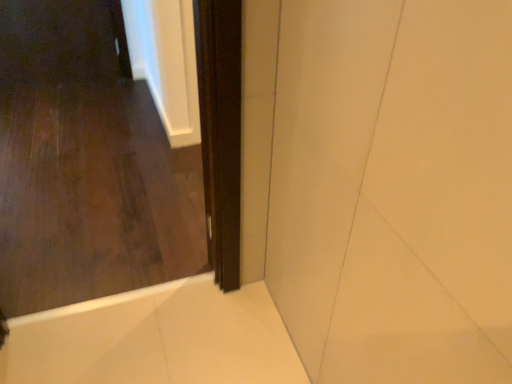
Question: Is dark wood door at center located outside dark wood screen door at center?

Choices:
 (A) no
 (B) yes

Answer: (B)

Question: Is dark wood door at center oriented away from dark wood screen door at center?

Choices:
 (A) no
 (B) yes

Answer: (A)

Question: Does dark wood door at center have a greater width compared to dark wood screen door at center?

Choices:
 (A) yes
 (B) no

Answer: (A)

Question: Does dark wood door at center come in front of dark wood screen door at center?

Choices:
 (A) no
 (B) yes

Answer: (B)

Question: Does dark wood door at center have a smaller size compared to dark wood screen door at center?

Choices:
 (A) yes
 (B) no

Answer: (B)

Question: Are dark wood door at center and dark wood screen door at center located far from each other?

Choices:
 (A) no
 (B) yes

Answer: (A)

Question: Can you confirm if white glossy bath at lower right is bigger than dark wood door at center?

Choices:
 (A) yes
 (B) no

Answer: (B)

Question: Is white glossy bath at lower right to the left of dark wood door at center from the viewer's perspective?

Choices:
 (A) no
 (B) yes

Answer: (A)

Question: Does white glossy bath at lower right have a lesser width compared to dark wood door at center?

Choices:
 (A) yes
 (B) no

Answer: (B)

Question: From the image's perspective, is white glossy bath at lower right located beneath dark wood door at center?

Choices:
 (A) no
 (B) yes

Answer: (B)

Question: Considering the relative sizes of white glossy bath at lower right and dark wood door at center in the image provided, is white glossy bath at lower right taller than dark wood door at center?

Choices:
 (A) no
 (B) yes

Answer: (A)

Question: Is white glossy bath at lower right positioned with its back to dark wood door at center?

Choices:
 (A) no
 (B) yes

Answer: (A)

Question: Is dark wood screen door at center not near dark wood door at center?

Choices:
 (A) no
 (B) yes

Answer: (A)